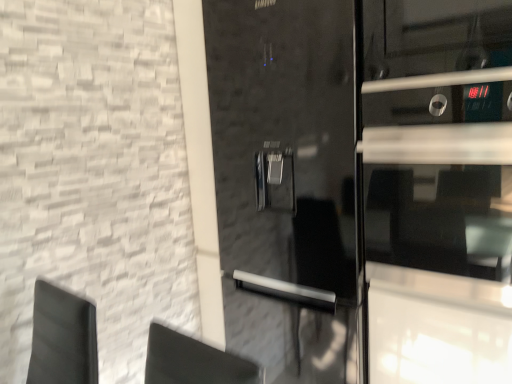
Question: Does point (274, 28) appear closer or farther from the camera than point (440, 349)?

Choices:
 (A) farther
 (B) closer

Answer: (A)

Question: From a real-world perspective, is glossy black refrigerator at center positioned above or below black glossy oven door at right?

Choices:
 (A) above
 (B) below

Answer: (B)

Question: Is glossy black refrigerator at center spatially inside black glossy oven door at right, or outside of it?

Choices:
 (A) inside
 (B) outside

Answer: (B)

Question: From a real-world perspective, is black glossy oven door at right above or below glossy black refrigerator at center?

Choices:
 (A) below
 (B) above

Answer: (B)

Question: Considering the positions of black glossy oven door at right and glossy black refrigerator at center in the image, is black glossy oven door at right taller or shorter than glossy black refrigerator at center?

Choices:
 (A) tall
 (B) short

Answer: (B)

Question: Looking at the image, does black glossy oven door at right seem bigger or smaller compared to glossy black refrigerator at center?

Choices:
 (A) big
 (B) small

Answer: (B)

Question: Considering the positions of black glossy oven door at right and glossy black refrigerator at center in the image, is black glossy oven door at right wider or thinner than glossy black refrigerator at center?

Choices:
 (A) wide
 (B) thin

Answer: (B)